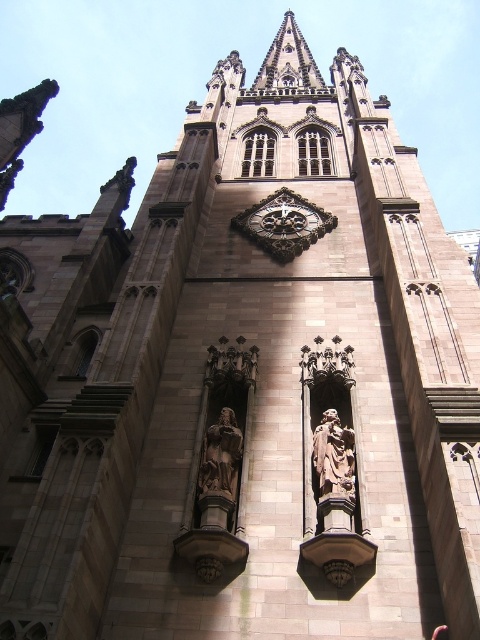
Describe the element at coordinates (220, 458) in the screenshot. This screenshot has width=480, height=640. I see `polished bronze statue at center` at that location.

Which is in front, point (241, 440) or point (351, 477)?

Point (351, 477) is more forward.

Is point (220, 438) positioned behind point (328, 476)?

That is True.

I want to click on polished bronze statue at center, so click(x=220, y=458).

Can you confirm if gold ornate clock at center is bigger than polished bronze statue at center?

Yes.

Does point (255, 216) come behind point (235, 486)?

That is True.

Which is behind, point (324, 212) or point (235, 458)?

The point (324, 212) is behind.

This screenshot has height=640, width=480. Identify the location of gold ornate clock at center. (284, 224).

Can you confirm if gold ornate clock at center is positioned to the right of brown stone statue at center?

Incorrect, gold ornate clock at center is not on the right side of brown stone statue at center.

Which is in front, point (323, 216) or point (335, 436)?

Point (335, 436) is in front.

At what (x,y) coordinates should I click in order to perform the action: click on gold ornate clock at center. Please return your answer as a coordinate pair (x, y). The width and height of the screenshot is (480, 640). Looking at the image, I should click on (284, 224).